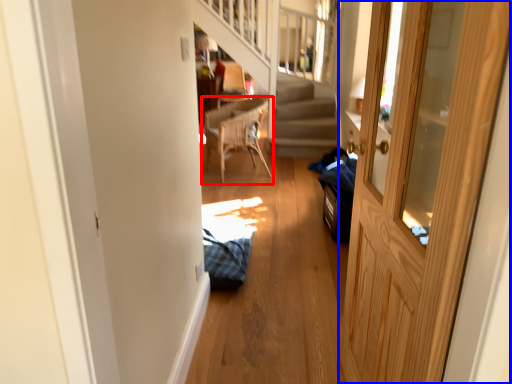
Question: Which object appears closest to the camera in this image, chair (highlighted by a red box) or door (highlighted by a blue box)?

Choices:
 (A) chair
 (B) door

Answer: (B)